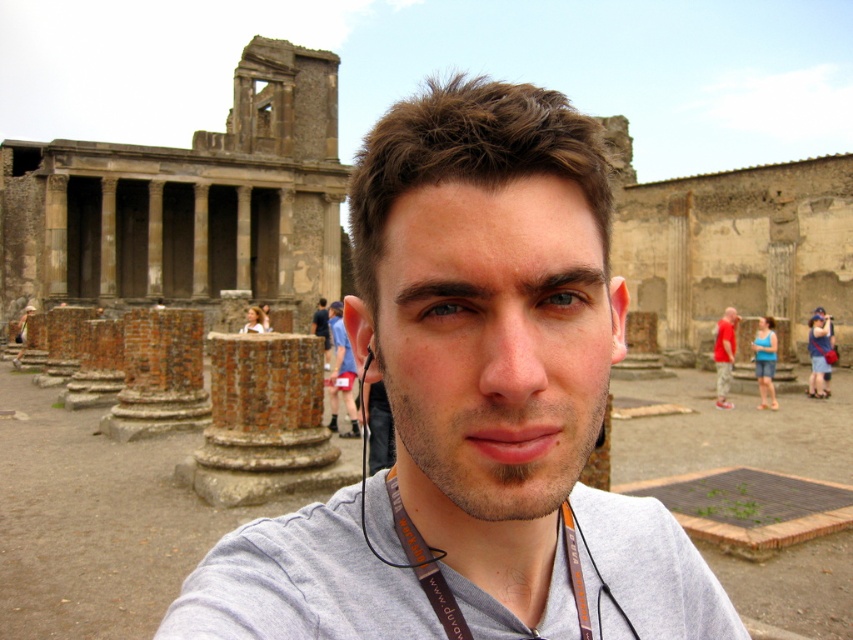
Is gray fabric at center to the left of red cotton shirt at right from the viewer's perspective?

Yes, gray fabric at center is to the left of red cotton shirt at right.

Based on the photo, does gray fabric at center appear on the right side of red cotton shirt at right?

Incorrect, gray fabric at center is not on the right side of red cotton shirt at right.

The height and width of the screenshot is (640, 853). What do you see at coordinates (300, 582) in the screenshot? I see `gray fabric at center` at bounding box center [300, 582].

Identify the location of gray fabric at center. (300, 582).

Which is behind, point (393, 552) or point (354, 429)?

The point (354, 429) is behind.

You are a GUI agent. You are given a task and a screenshot of the screen. Output one action in this format:
    pyautogui.click(x=<x>, y=<y>)
    Task: Click on the gray fabric at center
    This screenshot has width=853, height=640.
    Given the screenshot: What is the action you would take?
    pyautogui.click(x=300, y=582)

Who is lower down, gray fabric shirt at center or gray fabric at center?

gray fabric at center is below.

Which is more to the left, gray fabric shirt at center or gray fabric at center?

gray fabric at center is more to the left.

What do you see at coordinates (473, 406) in the screenshot?
I see `gray fabric shirt at center` at bounding box center [473, 406].

Find the location of a particular element. Image resolution: width=853 pixels, height=640 pixels. gray fabric shirt at center is located at coordinates tap(473, 406).